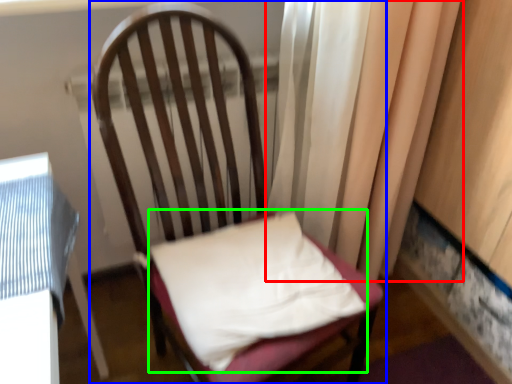
Question: Estimate the real-world distances between objects in this image. Which object is farther from curtain (highlighted by a red box), chair (highlighted by a blue box) or pillow (highlighted by a green box)?

Choices:
 (A) chair
 (B) pillow

Answer: (B)